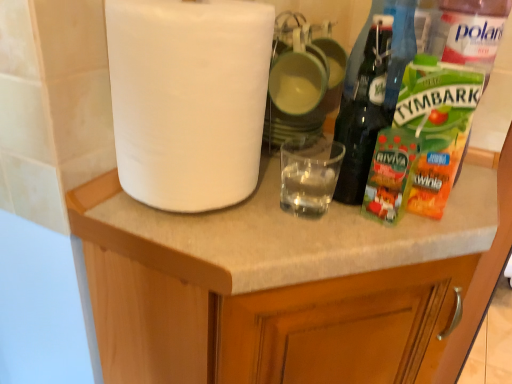
Question: Would you say white matte cabinet at upper left is to the left or to the right of white matte paper towel at upper left in the picture?

Choices:
 (A) right
 (B) left

Answer: (A)

Question: Is white matte cabinet at upper left bigger or smaller than white matte paper towel at upper left?

Choices:
 (A) big
 (B) small

Answer: (A)

Question: Is white matte cabinet at upper left wider or thinner than white matte paper towel at upper left?

Choices:
 (A) thin
 (B) wide

Answer: (B)

Question: Is white matte paper towel at upper left in front of or behind white matte cabinet at upper left in the image?

Choices:
 (A) behind
 (B) front

Answer: (A)

Question: Is white matte paper towel at upper left wider or thinner than white matte cabinet at upper left?

Choices:
 (A) thin
 (B) wide

Answer: (A)

Question: From a real-world perspective, relative to white matte cabinet at upper left, is white matte paper towel at upper left vertically above or below?

Choices:
 (A) below
 (B) above

Answer: (B)

Question: From the image's perspective, is white matte paper towel at upper left located above or below white matte cabinet at upper left?

Choices:
 (A) below
 (B) above

Answer: (B)